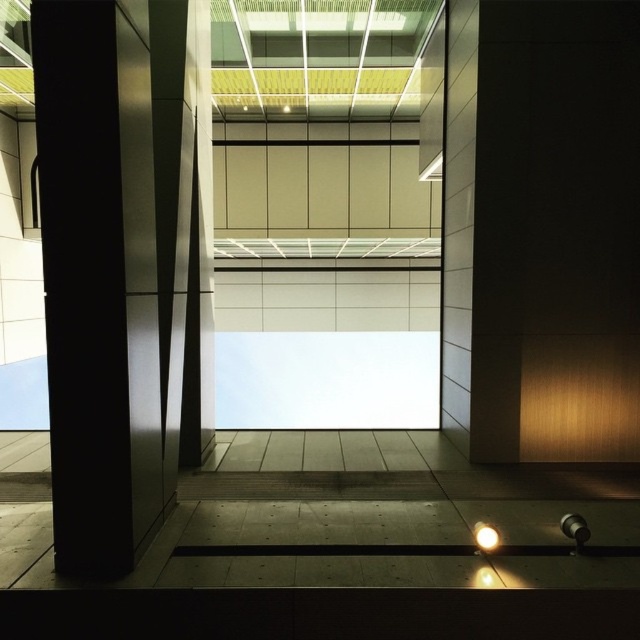
You are an interior designer planning to install a new fixture in this space. You have two options for placement. The first option is to place a decorative panel next to the metallic at left, and the second option is to place it next to the white glossy light bulb at lower center. Considering the size of the objects, which placement would allow for a larger decorative panel?

The metallic at left has a larger width than the white glossy light bulb at lower center, so placing the decorative panel next to the metallic at left would allow for a larger decorative panel.

You are standing in the modern architectural space and want to hang a new light fixture that is 1.2 meters tall. The existing white glossy light bulb at lower center is in the way. Can you safely install the new fixture above the metallic at left without obstructing the view through the central opening?

The metallic at left has a greater height compared to the white glossy light bulb at lower center. Since the new fixture is 1.2 meters tall and the metallic column is taller than the existing light bulb, there should be sufficient vertical space above the metallic column to install the new fixture without blocking the central opening. However, ensure the installation does not interfere with the structural integrity of the column or the opening.

You are an interior designer planning to install a new fixture in this space. You have two options available for installation based on the objects present. The first option requires placing a decorative item next to the metallic at left, and the second option involves hanging an accessory from the white glossy light bulb at lower center. Considering the size of the objects, which option might be more feasible and why?

The metallic at left is bigger than the white glossy light bulb at lower center, so the first option of placing a decorative item next to the metallic at left is more feasible because there is more space available around the larger object to accommodate the decorative item.